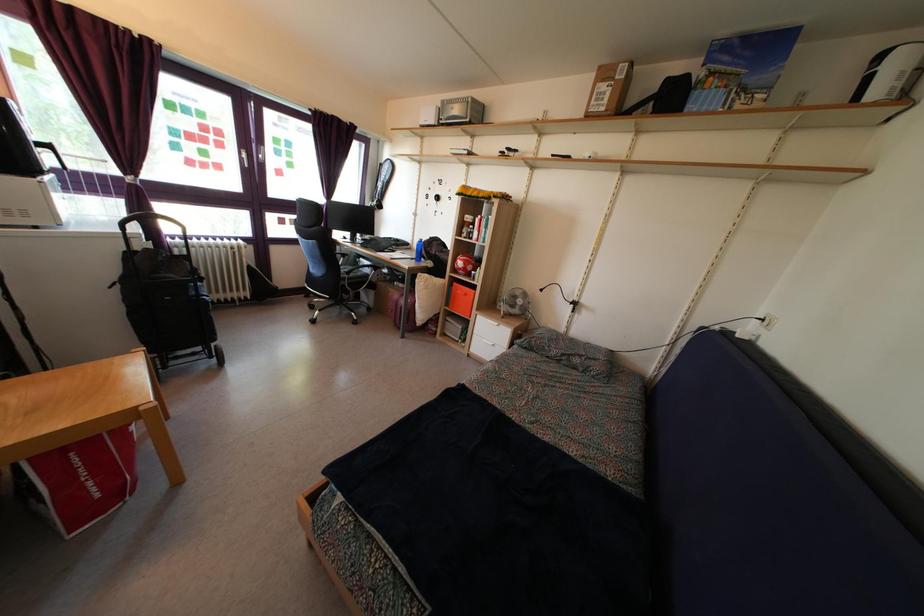
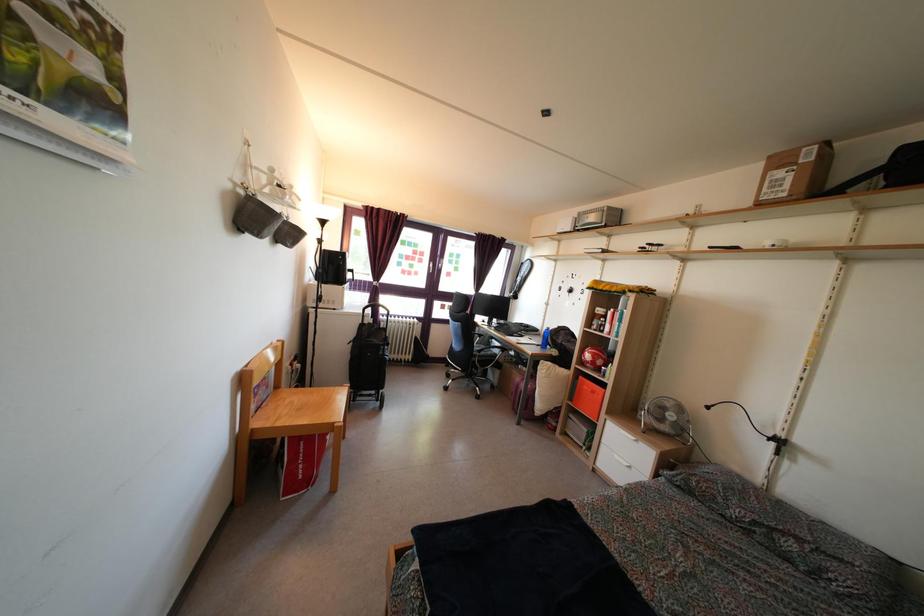
Based on the continuous images, in which direction is the camera rotating?

The rotation direction of the camera is left-up.